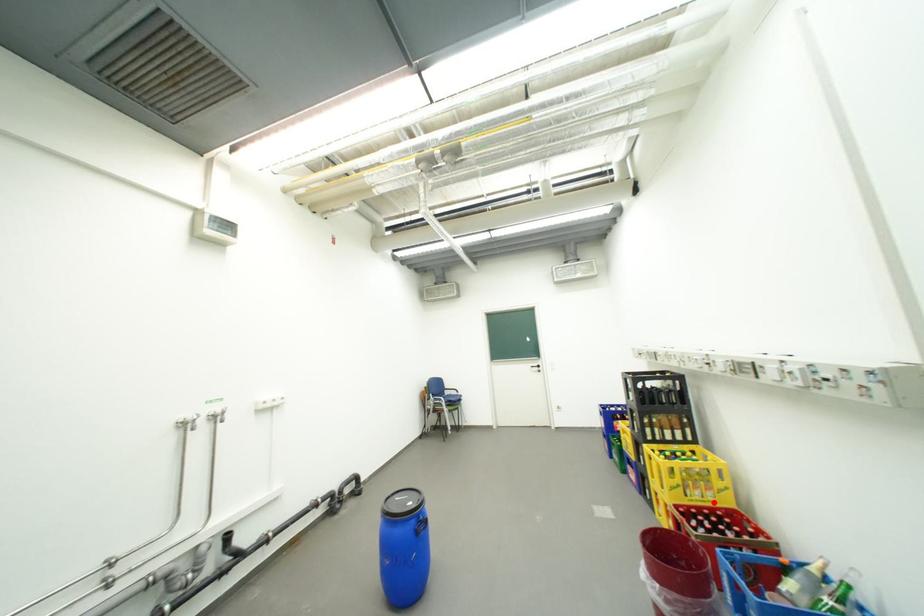
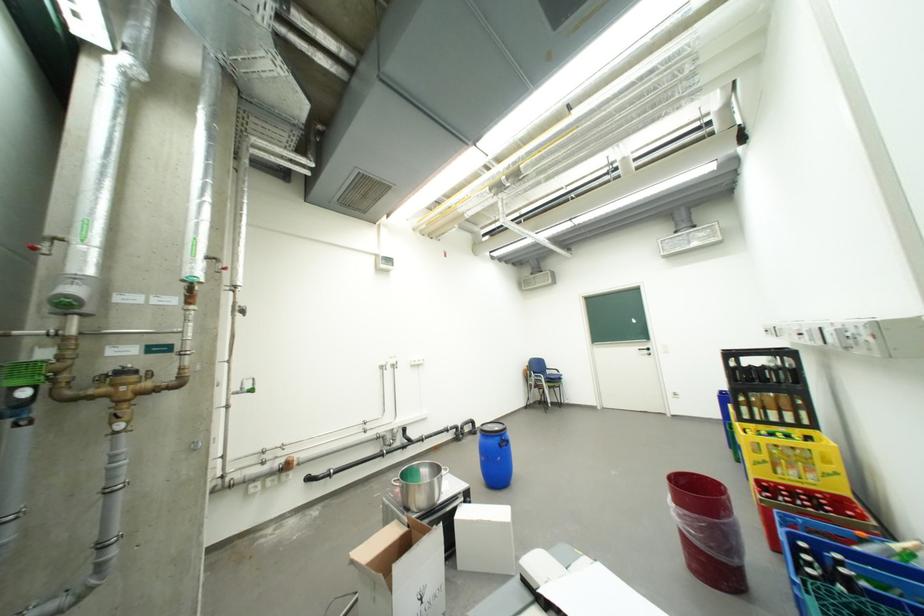
Locate, in the second image, the point that corresponds to the highlighted location in the first image.

(810, 484)